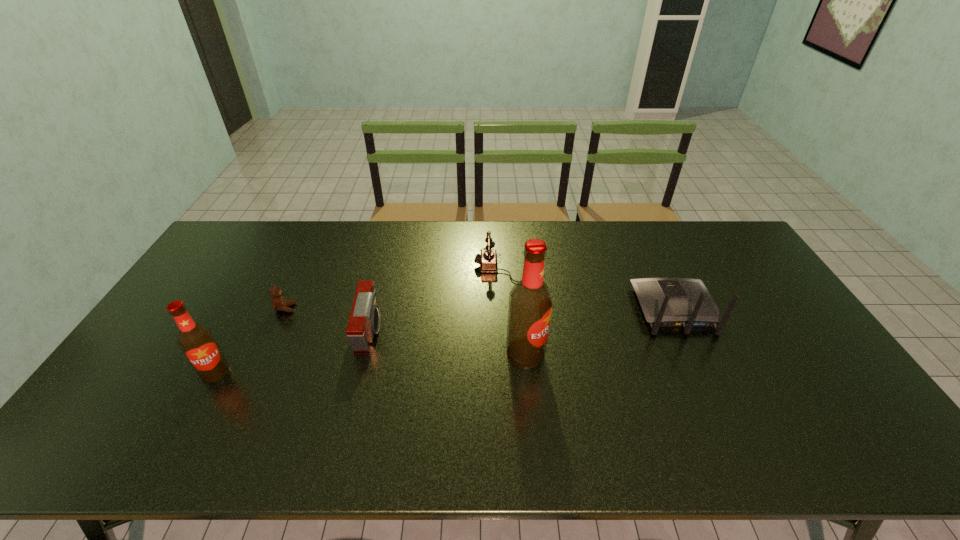
Where is `free spot that satisfies the following two spatial constraints: 1. on the front-facing side of the router; 2. on the dial of the telephone`? The width and height of the screenshot is (960, 540). free spot that satisfies the following two spatial constraints: 1. on the front-facing side of the router; 2. on the dial of the telephone is located at coordinates (656, 269).

You are a GUI agent. You are given a task and a screenshot of the screen. Output one action in this format:
    pyautogui.click(x=<x>, y=<y>)
    Task: Click on the free space that satisfies the following two spatial constraints: 1. on the dial of the telephone; 2. on the right side of the right beer bottle
    The height and width of the screenshot is (540, 960).
    Given the screenshot: What is the action you would take?
    pyautogui.click(x=512, y=353)

Find the location of a particular element. This screenshot has width=960, height=540. vacant region that satisfies the following two spatial constraints: 1. on the front-facing side of the router; 2. at the face of the second object from left to right is located at coordinates (674, 308).

Where is `vacant position in the image that satisfies the following two spatial constraints: 1. on the front-facing side of the fourth tallest object; 2. on the left side of the right beer bottle`? Image resolution: width=960 pixels, height=540 pixels. vacant position in the image that satisfies the following two spatial constraints: 1. on the front-facing side of the fourth tallest object; 2. on the left side of the right beer bottle is located at coordinates (365, 353).